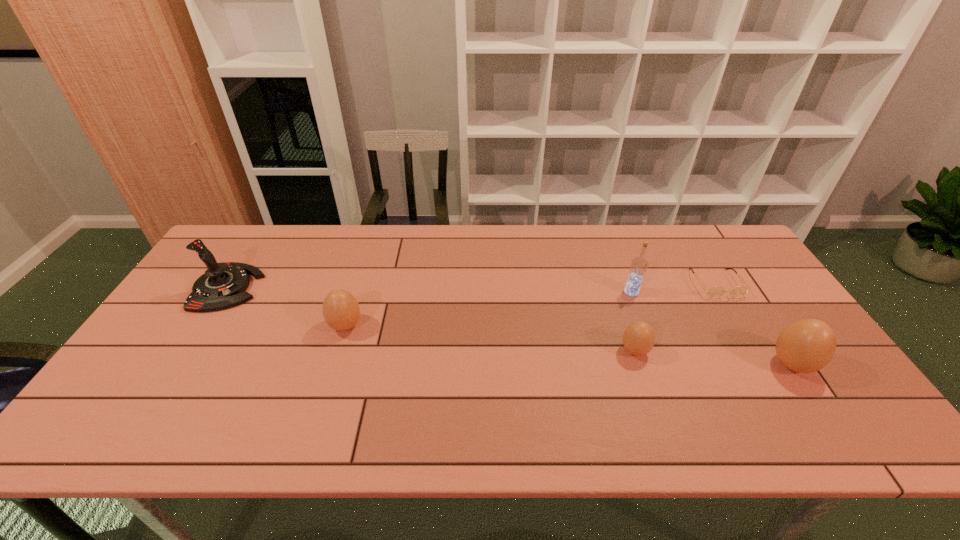
This screenshot has width=960, height=540. In order to click on the closest object to the second boiled egg from right to left in this screenshot , I will do `click(639, 265)`.

You are a GUI agent. You are given a task and a screenshot of the screen. Output one action in this format:
    pyautogui.click(x=<x>, y=<y>)
    Task: Click on the boiled egg identified as the closest to the joystick
    The height and width of the screenshot is (540, 960).
    Given the screenshot: What is the action you would take?
    pyautogui.click(x=341, y=311)

Choose which boiled egg is the third nearest neighbor to the leftmost object. Please provide its 2D coordinates. Your answer should be formatted as a tuple, i.e. [(x, y)], where the tuple contains the x and y coordinates of a point satisfying the conditions above.

[(808, 345)]

Where is `vacant space that satisfies the following two spatial constraints: 1. on the handle side of the joystick; 2. on the left side of the vodka`? The image size is (960, 540). vacant space that satisfies the following two spatial constraints: 1. on the handle side of the joystick; 2. on the left side of the vodka is located at coordinates (226, 292).

You are a GUI agent. You are given a task and a screenshot of the screen. Output one action in this format:
    pyautogui.click(x=<x>, y=<y>)
    Task: Click on the free point that satisfies the following two spatial constraints: 1. on the lenses of the spectacles; 2. on the handle side of the joystick
    The image size is (960, 540).
    Given the screenshot: What is the action you would take?
    pyautogui.click(x=718, y=288)

What are the coordinates of `vacant space that satisfies the following two spatial constraints: 1. on the front side of the third tallest object; 2. on the right side of the fifth tallest object` in the screenshot? It's located at (639, 364).

Locate an element on the screen. The width and height of the screenshot is (960, 540). vacant space that satisfies the following two spatial constraints: 1. on the handle side of the joystick; 2. on the left side of the fourth shortest object is located at coordinates (179, 364).

Where is `vacant space that satisfies the following two spatial constraints: 1. on the lenses of the third tallest object; 2. on the left side of the spectacles`? vacant space that satisfies the following two spatial constraints: 1. on the lenses of the third tallest object; 2. on the left side of the spectacles is located at coordinates (764, 364).

Where is `free location that satisfies the following two spatial constraints: 1. on the back side of the tallest boiled egg; 2. on the handle side of the joystick`? Image resolution: width=960 pixels, height=540 pixels. free location that satisfies the following two spatial constraints: 1. on the back side of the tallest boiled egg; 2. on the handle side of the joystick is located at coordinates (741, 288).

This screenshot has height=540, width=960. What are the coordinates of `blank area in the image that satisfies the following two spatial constraints: 1. on the handle side of the rightmost boiled egg; 2. on the left side of the leftmost object` in the screenshot? It's located at (179, 364).